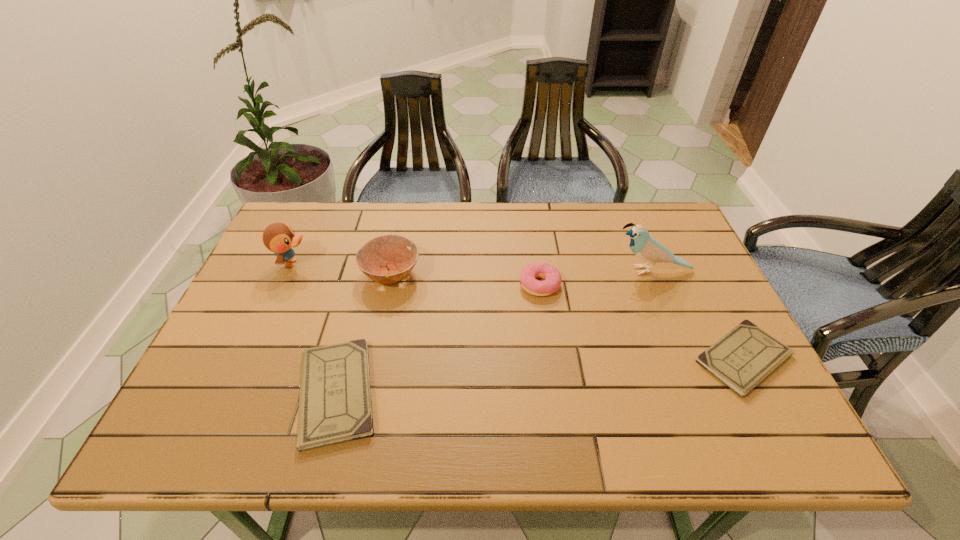
The height and width of the screenshot is (540, 960). Identify the location of bird located in the right edge section of the desktop. (647, 248).

You are a GUI agent. You are given a task and a screenshot of the screen. Output one action in this format:
    pyautogui.click(x=<x>, y=<y>)
    Task: Click on the object present at the near right corner
    
    Given the screenshot: What is the action you would take?
    pyautogui.click(x=744, y=357)

Where is `vacant area at the far edge of the desktop`? vacant area at the far edge of the desktop is located at coordinates (330, 249).

You are a GUI agent. You are given a task and a screenshot of the screen. Output one action in this format:
    pyautogui.click(x=<x>, y=<y>)
    Task: Click on the free region at the near edge of the desktop
    This screenshot has height=540, width=960.
    Given the screenshot: What is the action you would take?
    pyautogui.click(x=416, y=377)

Find the location of a particular element. The width and height of the screenshot is (960, 540). free space at the left edge of the desktop is located at coordinates (289, 301).

The image size is (960, 540). In the image, there is a desktop. In order to click on vacant space at the far left corner in this screenshot , I will do `click(313, 213)`.

Find the location of a particular element. Image resolution: width=960 pixels, height=540 pixels. vacant space at the far right corner is located at coordinates (668, 220).

This screenshot has height=540, width=960. What are the coordinates of `vacant area that lies between the fourth tallest object and the tallest object` in the screenshot? It's located at (595, 278).

You are a GUI agent. You are given a task and a screenshot of the screen. Output one action in this format:
    pyautogui.click(x=<x>, y=<y>)
    Task: Click on the free spot between the bowl and the bird
    
    Given the screenshot: What is the action you would take?
    click(x=521, y=272)

Find the location of a particular element. Image resolution: width=960 pixels, height=540 pixels. vacant space that's between the shorter checkbook and the left checkbook is located at coordinates (540, 376).